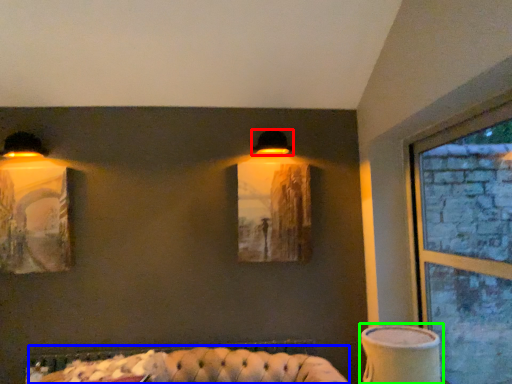
Question: Which is farther away from lamp (highlighted by a red box)? couch (highlighted by a blue box) or table lamp (highlighted by a green box)?

Choices:
 (A) couch
 (B) table lamp

Answer: (A)